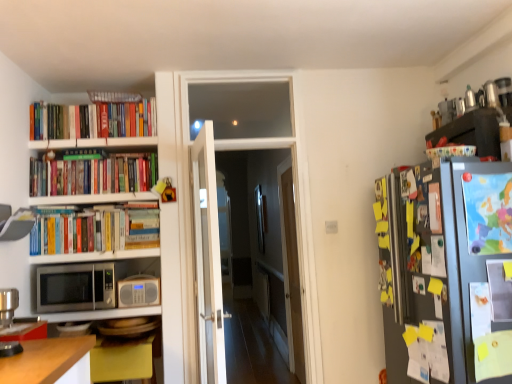
Question: Does silver metallic microwave at lower left have a larger size compared to hardcover books at upper left, marked as the third book in a bottom-to-top arrangement?

Choices:
 (A) yes
 (B) no

Answer: (A)

Question: Is silver metallic microwave at lower left shorter than hardcover books at upper left, marked as the third book in a bottom-to-top arrangement?

Choices:
 (A) no
 (B) yes

Answer: (A)

Question: Is silver metallic microwave at lower left smaller than hardcover books at upper left, marked as the third book in a bottom-to-top arrangement?

Choices:
 (A) no
 (B) yes

Answer: (A)

Question: Can hardcover books at upper left, the 1th book in the top-to-bottom sequence, be found inside silver metallic microwave at lower left?

Choices:
 (A) yes
 (B) no

Answer: (B)

Question: Can you confirm if silver metallic microwave at lower left is positioned to the left of hardcover books at upper left, the 1th book in the top-to-bottom sequence?

Choices:
 (A) yes
 (B) no

Answer: (A)

Question: Considering the positions of metallic silver coffee machine at lower left and yellow matte table at lower left in the image, is metallic silver coffee machine at lower left wider or thinner than yellow matte table at lower left?

Choices:
 (A) thin
 (B) wide

Answer: (A)

Question: In the image, is metallic silver coffee machine at lower left positioned in front of or behind yellow matte table at lower left?

Choices:
 (A) behind
 (B) front

Answer: (B)

Question: Is point (33, 336) positioned closer to the camera than point (132, 347)?

Choices:
 (A) closer
 (B) farther

Answer: (A)

Question: In terms of size, does metallic silver coffee machine at lower left appear bigger or smaller than yellow matte table at lower left?

Choices:
 (A) big
 (B) small

Answer: (B)

Question: Considering the positions of hardcover books at upper left, acting as the second book starting from the bottom, and yellow matte table at lower left in the image, is hardcover books at upper left, acting as the second book starting from the bottom, bigger or smaller than yellow matte table at lower left?

Choices:
 (A) big
 (B) small

Answer: (B)

Question: From the image's perspective, is hardcover books at upper left, acting as the 2th book starting from the top, positioned above or below yellow matte table at lower left?

Choices:
 (A) below
 (B) above

Answer: (B)

Question: In the image, is hardcover books at upper left, acting as the 2th book starting from the top, positioned in front of or behind yellow matte table at lower left?

Choices:
 (A) behind
 (B) front

Answer: (A)

Question: In the image, is hardcover books at upper left, acting as the 2th book starting from the top, on the left side or the right side of yellow matte table at lower left?

Choices:
 (A) left
 (B) right

Answer: (A)

Question: Is beige plastic radio at left bigger or smaller than transparent glass door at center, the second glass door positioned from the front?

Choices:
 (A) big
 (B) small

Answer: (B)

Question: From a real-world perspective, is beige plastic radio at left above or below transparent glass door at center, the second glass door positioned from the front?

Choices:
 (A) below
 (B) above

Answer: (B)